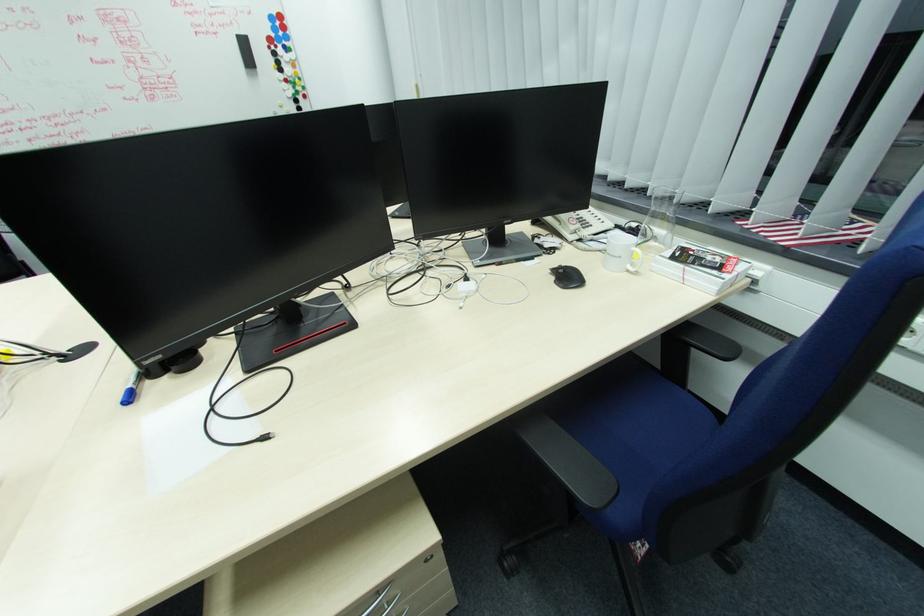
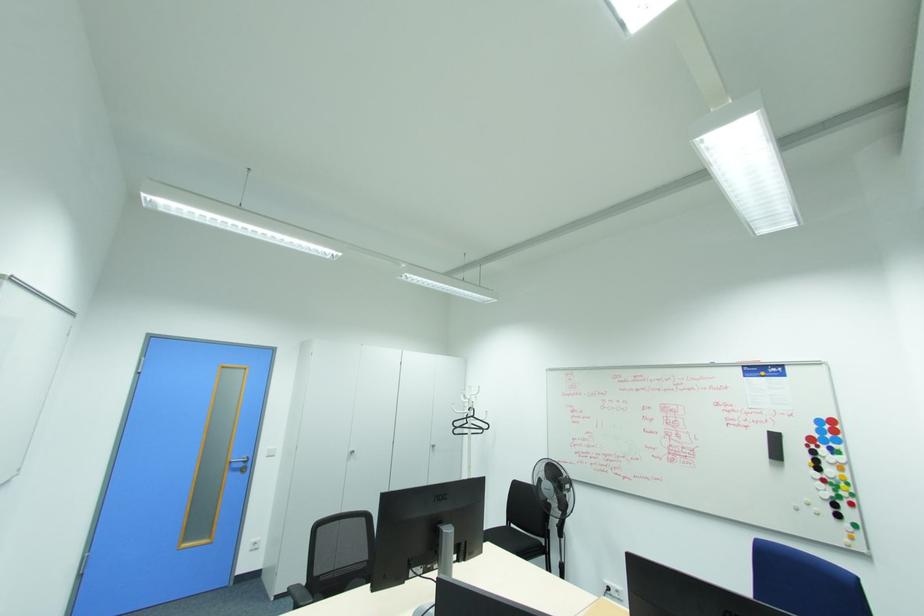
Question: The camera is either moving clockwise (left) or counter-clockwise (right) around the object. The first image is from the beginning of the video and the second image is from the end. Is the camera moving left or right when shooting the video?

Choices:
 (A) Left
 (B) Right

Answer: (B)